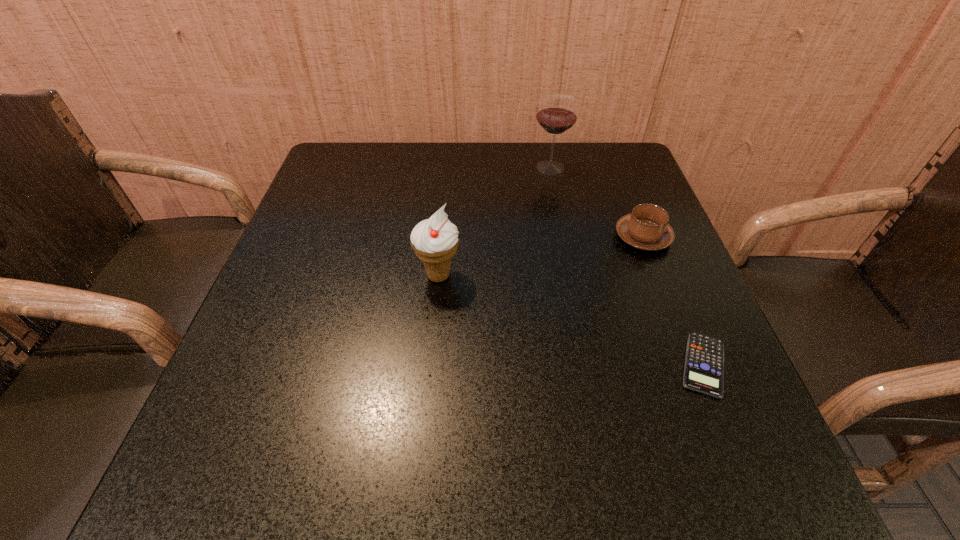
At what (x,y) coordinates should I click in order to perform the action: click on vacant area between the second nearest object and the farthest object. Please return your answer as a coordinate pair (x, y). This screenshot has height=540, width=960. Looking at the image, I should click on (494, 221).

Identify the location of vacant region between the nearest object and the cappuccino. The width and height of the screenshot is (960, 540). (673, 301).

Where is `empty space between the second farthest object and the shortest object`? This screenshot has height=540, width=960. empty space between the second farthest object and the shortest object is located at coordinates tap(673, 301).

You are a GUI agent. You are given a task and a screenshot of the screen. Output one action in this format:
    pyautogui.click(x=<x>, y=<y>)
    Task: Click on the object that stands as the second closest to the leftmost object
    The height and width of the screenshot is (540, 960).
    Given the screenshot: What is the action you would take?
    pyautogui.click(x=557, y=113)

Identify which object is the second nearest to the nearest object. Please provide its 2D coordinates. Your answer should be formatted as a tuple, i.e. [(x, y)], where the tuple contains the x and y coordinates of a point satisfying the conditions above.

[(435, 240)]

Image resolution: width=960 pixels, height=540 pixels. In order to click on free space that satisfies the following two spatial constraints: 1. on the back side of the icecream; 2. on the left side of the wineglass in this screenshot , I will do `click(448, 167)`.